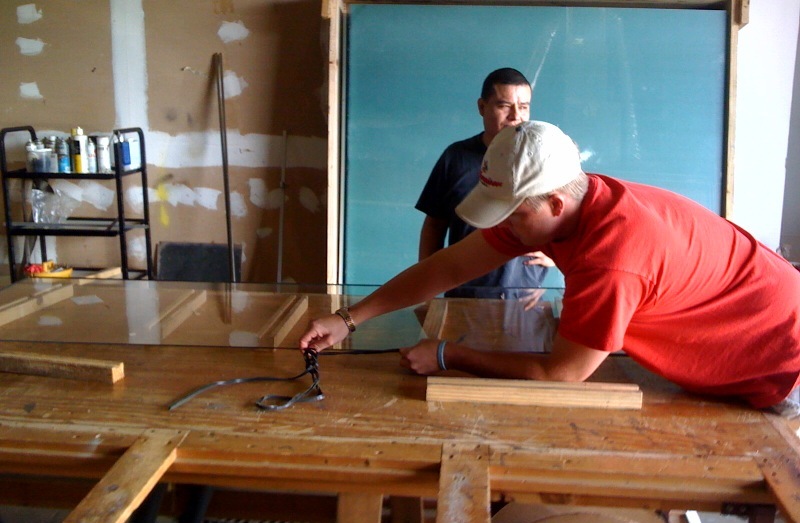
The height and width of the screenshot is (523, 800). I want to click on shelf/rolling cart, so click(77, 228), click(117, 181), click(14, 126).